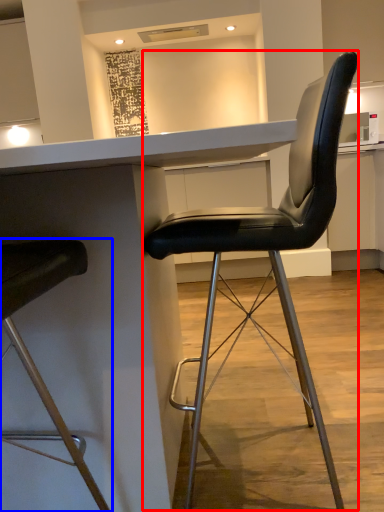
Question: Among these objects, which one is farthest to the camera, chair (highlighted by a red box) or chair (highlighted by a blue box)?

Choices:
 (A) chair
 (B) chair

Answer: (A)